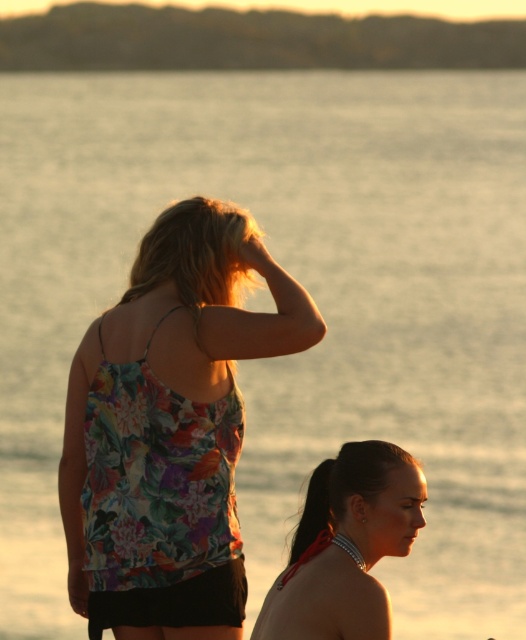
You are a photographer trying to capture the sunset scene. You notice a point at coordinates (x=156, y=477) in the image. Based on the scene description, what object is located at that point?

The point at coordinates (x=156, y=477) indicates the floral print fabric bikini top at upper left.

You are a photographer trying to capture the sunset scene. You need to focus on the floral print fabric bikini top at upper left. According to the coordinates provided, where exactly should you position your camera to ensure it is centered in your shot?

To center the floral print fabric bikini top at upper left in your shot, position your camera so that it aligns with the coordinates point (156, 477).